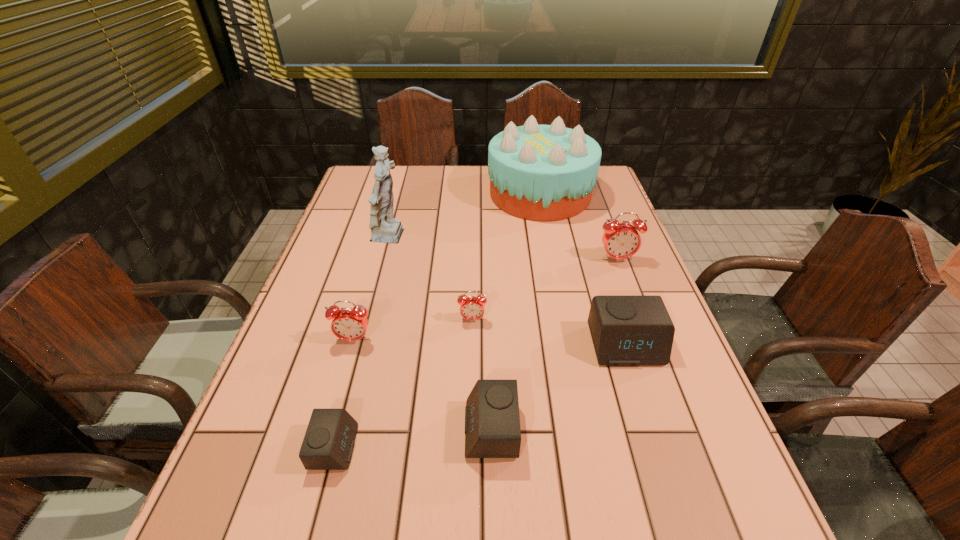
This screenshot has width=960, height=540. What are the coordinates of `the second farthest alarm clock` in the screenshot? It's located at (471, 308).

Find the location of a particular element. Image resolution: width=960 pixels, height=540 pixels. the fifth nearest object is located at coordinates (471, 308).

I want to click on the second smallest black alarm clock, so click(x=492, y=421).

Locate an element on the screen. the smallest black alarm clock is located at coordinates (328, 444).

Find the location of a particular element. the shortest alarm clock is located at coordinates (328, 444).

You are a GUI agent. You are given a task and a screenshot of the screen. Output one action in this format:
    pyautogui.click(x=<x>, y=<y>)
    Task: Click on the free space located on the front-facing side of the figurine
    
    Given the screenshot: What is the action you would take?
    pyautogui.click(x=450, y=238)

What are the coordinates of `free point located on the front of the seventh shortest object` in the screenshot? It's located at (552, 256).

What are the coordinates of `free space located on the face of the rightmost red alarm clock` in the screenshot? It's located at (661, 379).

At what (x,y) coordinates should I click in order to perform the action: click on vacant space situated on the face of the leftmost red alarm clock. Please return your answer as a coordinate pair (x, y). Image resolution: width=960 pixels, height=540 pixels. Looking at the image, I should click on (343, 380).

The width and height of the screenshot is (960, 540). Find the location of `free space located on the front-facing side of the rightmost black alarm clock`. free space located on the front-facing side of the rightmost black alarm clock is located at coordinates (686, 535).